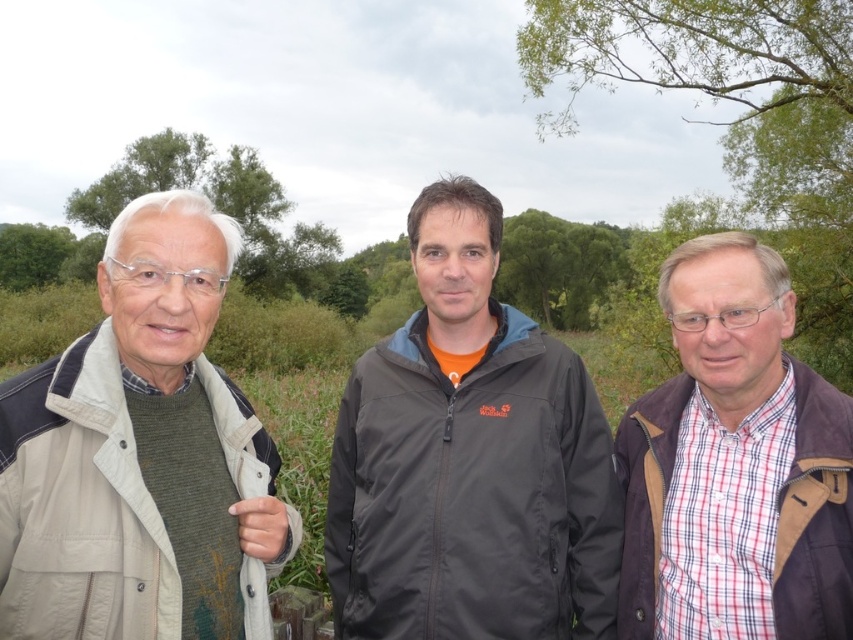
Question: Which object appears farthest from the camera in this image?

Choices:
 (A) dark gray jacket at center
 (B) green leafy tree at upper left
 (C) knit green sweater at left

Answer: (B)

Question: Is green leafy tree at upper center to the right of green leafy tree at left from the viewer's perspective?

Choices:
 (A) yes
 (B) no

Answer: (A)

Question: Does dark gray jacket at center have a smaller size compared to plaid fabric shirt at right?

Choices:
 (A) no
 (B) yes

Answer: (A)

Question: Is plaid fabric shirt at right closer to the viewer compared to green leafy tree at upper center?

Choices:
 (A) yes
 (B) no

Answer: (A)

Question: Which point is farther from the camera taking this photo?

Choices:
 (A) click(502, 460)
 (B) click(833, 404)
 (C) click(254, 253)

Answer: (C)

Question: Which point is closer to the camera?

Choices:
 (A) green leafy tree at upper center
 (B) knit green sweater at left
 (C) plaid fabric shirt at right
 (D) green leafy branches at upper center

Answer: (B)